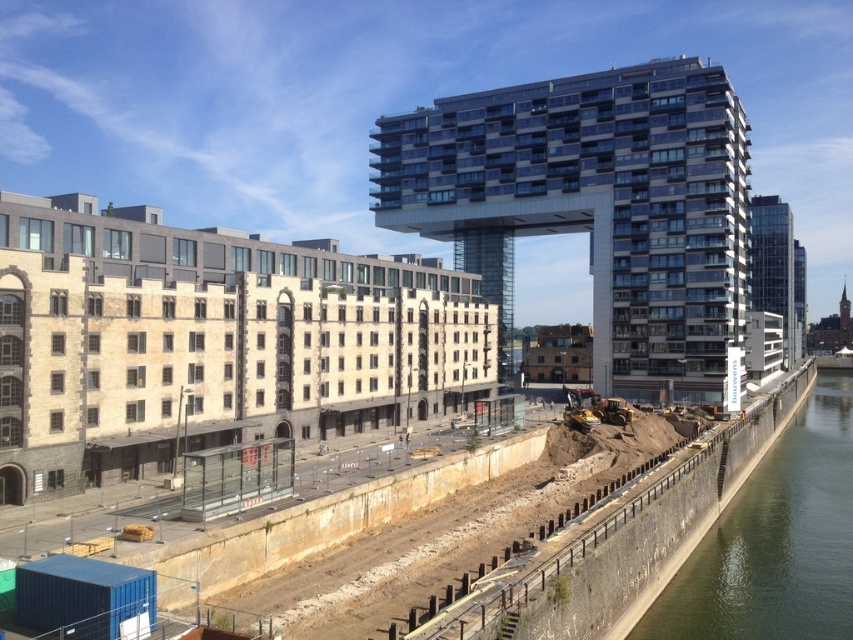
You are standing at the riverside and want to take a photo of the beige stone building at center. If your camera can focus on objects up to 50 meters away, will you need to adjust your position to capture the building clearly?

The beige stone building at center is 50.92 meters away from the viewer. Since the camera can only focus up to 50 meters, you will need to move closer to ensure the building is in focus.

You are standing at the point with coordinates point [67,369] and want to walk towards the point [836,499]. According to the scene, will you be moving towards or away from the modern building in the center right?

Since point [67,369] is in front of point [836,499], moving from point [67,369] towards point [836,499] means you are moving away from the modern building in the center right.

You are an urban planner assessing the impact of new construction on the riverside area. The beige stone building at center and the glassy steel building at center are both under consideration. Based on their spatial requirements, which building would require a smaller plot of land for construction?

The beige stone building at center occupies less space than the glassy steel building at center, so the beige stone building at center would require a smaller plot of land for construction.